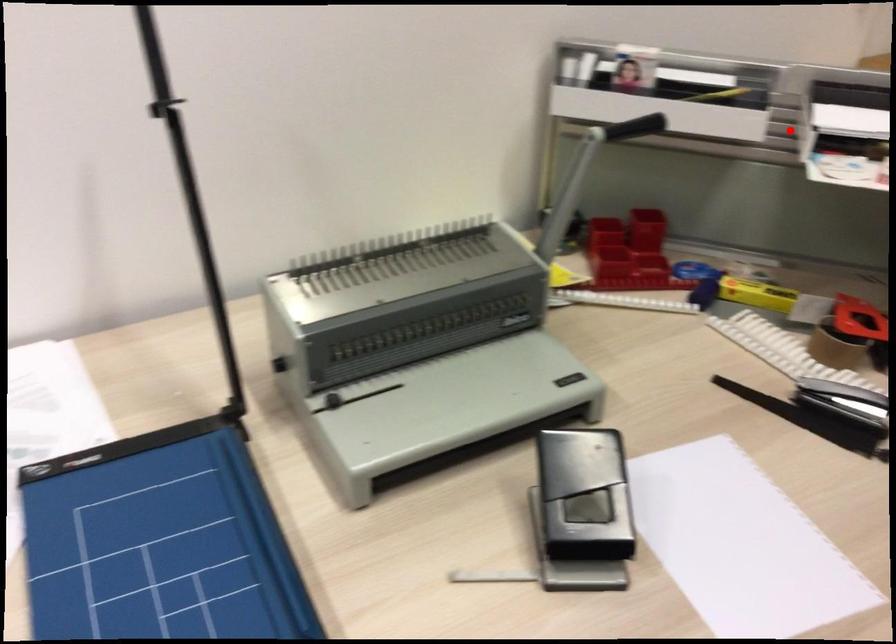
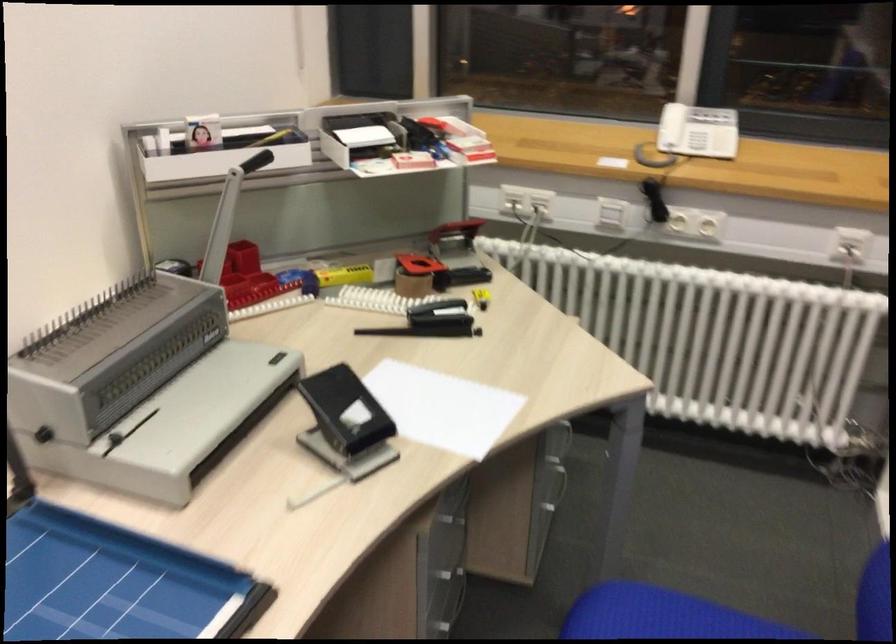
Question: I am providing you with two images of the same scene from different viewpoints. A red point is marked on the first image. Can you still see the location of the red point in image 2?

Choices:
 (A) Yes
 (B) No

Answer: (A)